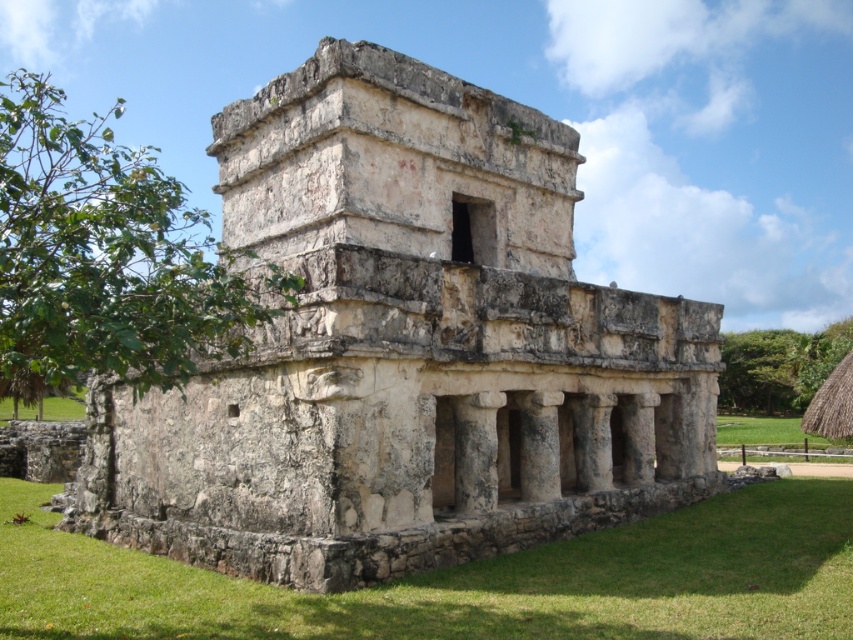
Between point (267, 584) and point (724, 429), which one is positioned behind?

Positioned behind is point (724, 429).

Does green grass at lower center appear on the right side of green grass at lower right?

In fact, green grass at lower center is to the left of green grass at lower right.

Does point (639, 541) come closer to viewer compared to point (811, 438)?

Yes, point (639, 541) is in front of point (811, 438).

At what (x,y) coordinates should I click in order to perform the action: click on green grass at lower center. Please return your answer as a coordinate pair (x, y). Looking at the image, I should click on (469, 580).

Which of these two, stone ruins at center or green grass at lower right, stands taller?

Standing taller between the two is stone ruins at center.

Does stone ruins at center have a smaller size compared to green grass at lower right?

Indeed, stone ruins at center has a smaller size compared to green grass at lower right.

Measure the distance between stone ruins at center and camera.

stone ruins at center is 117.42 feet from camera.

The width and height of the screenshot is (853, 640). What are the coordinates of `stone ruins at center` in the screenshot? It's located at (405, 349).

Can you confirm if stone ruins at center is thinner than green grass at lower center?

Yes.

The height and width of the screenshot is (640, 853). I want to click on stone ruins at center, so coord(405,349).